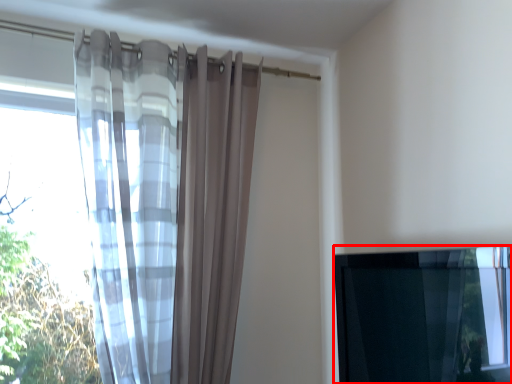
Question: Observing the image, what is the correct spatial positioning of window (annotated by the red box) in reference to curtain?

Choices:
 (A) right
 (B) left

Answer: (A)